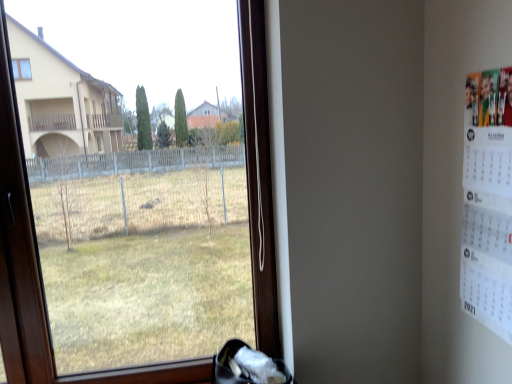
What is the approximate width of white paper calendar at right?

1.73 inches.

Measure the distance between white paper calendar at right and camera.

The distance of white paper calendar at right from camera is 1.11 meters.

The height and width of the screenshot is (384, 512). What do you see at coordinates (155, 259) in the screenshot? I see `transparent glass window at center` at bounding box center [155, 259].

The height and width of the screenshot is (384, 512). In order to click on white fabric shoe at lower center in this screenshot , I will do `click(247, 366)`.

Which is in front, point (131, 175) or point (502, 179)?

The point (502, 179) is in front.

From the image's perspective, does transparent glass window at center appear lower than white paper calendar at right?

Yes.

Who is more distant, transparent glass window at center or white paper calendar at right?

transparent glass window at center is more distant.

Is white paper calendar at right in front of or behind white fabric shoe at lower center in the image?

Visually, white paper calendar at right is located in front of white fabric shoe at lower center.

Could you tell me if white paper calendar at right is turned towards white fabric shoe at lower center?

No, white paper calendar at right does not turn towards white fabric shoe at lower center.

Who is shorter, white paper calendar at right or white fabric shoe at lower center?

white fabric shoe at lower center.

How much distance is there between white paper calendar at right and white fabric shoe at lower center?

The distance of white paper calendar at right from white fabric shoe at lower center is 37.78 inches.

Does point (501, 107) lie behind point (95, 267)?

No.

Are white paper calendar at right and transparent glass window at center beside each other?

No, white paper calendar at right is not in contact with transparent glass window at center.

Is white paper calendar at right thinner than transparent glass window at center?

Indeed, white paper calendar at right has a lesser width compared to transparent glass window at center.

Can you confirm if white paper calendar at right is smaller than transparent glass window at center?

Correct, white paper calendar at right occupies less space than transparent glass window at center.

Considering the sizes of white fabric shoe at lower center and white paper calendar at right in the image, is white fabric shoe at lower center taller or shorter than white paper calendar at right?

In the image, white fabric shoe at lower center appears to be shorter than white paper calendar at right.

From the image's perspective, between white fabric shoe at lower center and white paper calendar at right, who is located below?

white fabric shoe at lower center is shown below in the image.

How different are the orientations of white fabric shoe at lower center and white paper calendar at right in degrees?

The facing directions of white fabric shoe at lower center and white paper calendar at right are 91 degrees apart.

Can you confirm if white fabric shoe at lower center is positioned to the right of white paper calendar at right?

No, white fabric shoe at lower center is not to the right of white paper calendar at right.

From a real-world perspective, which is physically below, transparent glass window at center or white fabric shoe at lower center?

white fabric shoe at lower center.

Does transparent glass window at center lie in front of white fabric shoe at lower center?

Yes, transparent glass window at center is closer to the camera.

How many degrees apart are the facing directions of transparent glass window at center and white fabric shoe at lower center?

They differ by 0.00307 degrees in their facing directions.

Is white fabric shoe at lower center facing towards transparent glass window at center?

No, white fabric shoe at lower center is not facing towards transparent glass window at center.

Consider the image. Is white fabric shoe at lower center not close to transparent glass window at center?

That's right, there is a large distance between white fabric shoe at lower center and transparent glass window at center.

From the image's perspective, relative to transparent glass window at center, is white fabric shoe at lower center above or below?

Based on their image positions, white fabric shoe at lower center is located beneath transparent glass window at center.

Does point (218, 364) lie behind point (269, 210)?

Yes, point (218, 364) is farther from viewer.

Locate an element on the screen. The image size is (512, 384). window that appears below the white paper calendar at right (from a real-world perspective) is located at coordinates (155, 259).

The height and width of the screenshot is (384, 512). I want to click on shoe that appears below the white paper calendar at right (from the image's perspective), so click(x=247, y=366).

Considering their positions, is white paper calendar at right positioned further to transparent glass window at center than white fabric shoe at lower center?

Based on the image, white paper calendar at right appears to be further to transparent glass window at center.

When comparing their distances from white fabric shoe at lower center, does white paper calendar at right or transparent glass window at center seem closer?

Among the two, white paper calendar at right is located nearer to white fabric shoe at lower center.

Consider the image. Which object lies further to the anchor point white paper calendar at right, white fabric shoe at lower center or transparent glass window at center?

transparent glass window at center lies further to white paper calendar at right than the other object.

Based on their spatial positions, is transparent glass window at center or white paper calendar at right closer to white fabric shoe at lower center?

The object closer to white fabric shoe at lower center is white paper calendar at right.

Which object lies further to the anchor point white paper calendar at right, transparent glass window at center or white fabric shoe at lower center?

transparent glass window at center.

Estimate the real-world distances between objects in this image. Which object is further from transparent glass window at center, white fabric shoe at lower center or white paper calendar at right?

Among the two, white paper calendar at right is located further to transparent glass window at center.

In order to click on shoe between transparent glass window at center and white paper calendar at right from left to right in this screenshot , I will do `click(247, 366)`.